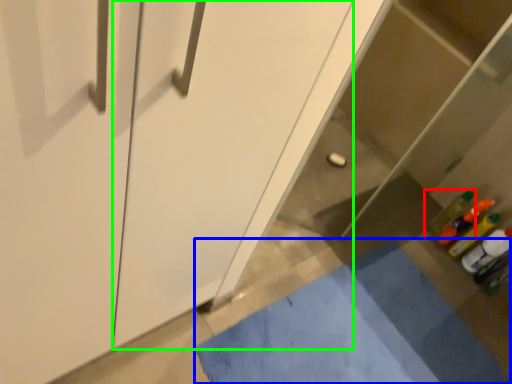
Question: Estimate the real-world distances between objects in this image. Which object is farther from bottle (highlighted by a red box), bath mat (highlighted by a blue box) or screen door (highlighted by a green box)?

Choices:
 (A) bath mat
 (B) screen door

Answer: (B)